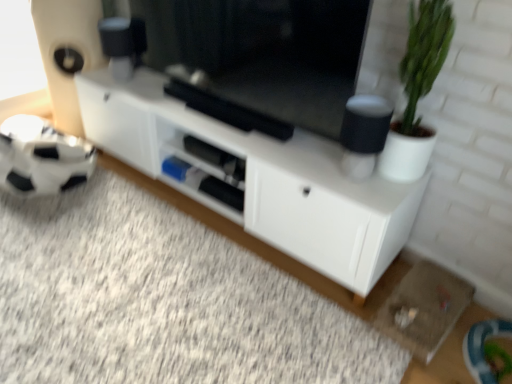
Question: Should I look upward or downward to see black matte tv at center?

Choices:
 (A) down
 (B) up

Answer: (B)

Question: Considering the relative sizes of green matte plant at right and white matte cabinet at center in the image provided, is green matte plant at right shorter than white matte cabinet at center?

Choices:
 (A) yes
 (B) no

Answer: (B)

Question: From a real-world perspective, does green matte plant at right sit lower than white matte cabinet at center?

Choices:
 (A) yes
 (B) no

Answer: (B)

Question: From the image's perspective, would you say green matte plant at right is shown under white matte cabinet at center?

Choices:
 (A) yes
 (B) no

Answer: (B)

Question: Can you confirm if green matte plant at right is bigger than white matte cabinet at center?

Choices:
 (A) yes
 (B) no

Answer: (B)

Question: Does green matte plant at right appear on the right side of white matte cabinet at center?

Choices:
 (A) yes
 (B) no

Answer: (A)

Question: Would you consider green matte plant at right to be distant from white matte cabinet at center?

Choices:
 (A) yes
 (B) no

Answer: (B)

Question: Can you confirm if black matte tv at center is bigger than green matte plant at right?

Choices:
 (A) yes
 (B) no

Answer: (A)

Question: Is black matte tv at center aimed at green matte plant at right?

Choices:
 (A) no
 (B) yes

Answer: (A)

Question: Can you confirm if black matte tv at center is shorter than green matte plant at right?

Choices:
 (A) yes
 (B) no

Answer: (A)

Question: Is the position of black matte tv at center more distant than that of green matte plant at right?

Choices:
 (A) yes
 (B) no

Answer: (A)

Question: Are black matte tv at center and green matte plant at right making contact?

Choices:
 (A) no
 (B) yes

Answer: (A)

Question: Is black matte tv at center to the left of green matte plant at right from the viewer's perspective?

Choices:
 (A) no
 (B) yes

Answer: (B)

Question: From the image's perspective, would you say white matte cabinet at center is positioned over green matte plant at right?

Choices:
 (A) no
 (B) yes

Answer: (A)